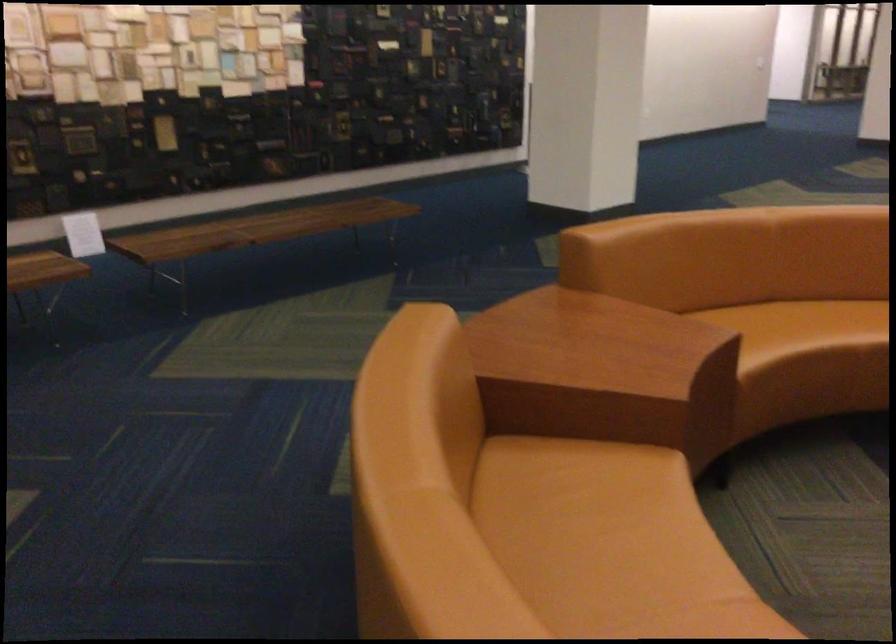
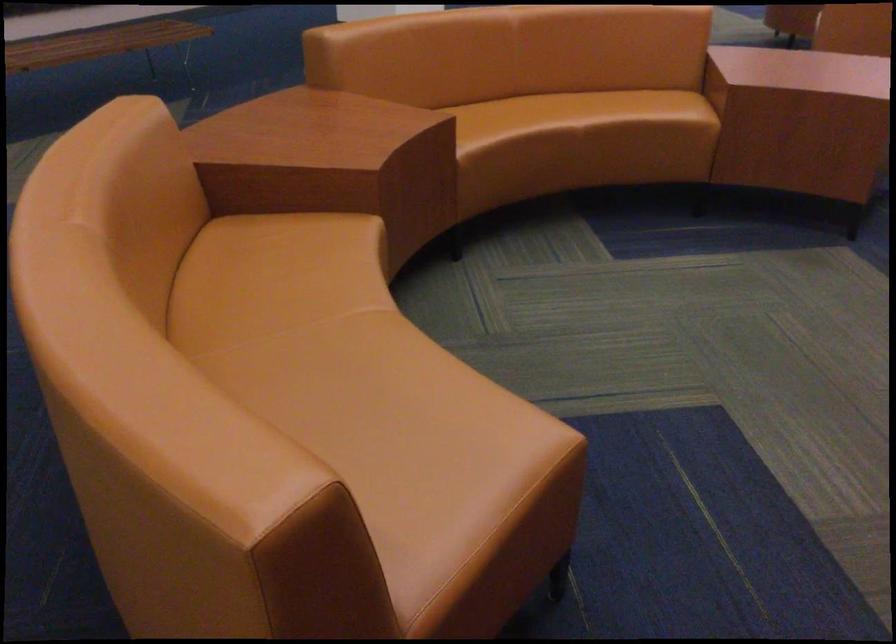
Find the pixel in the second image that matches (x=807, y=317) in the first image.

(538, 113)